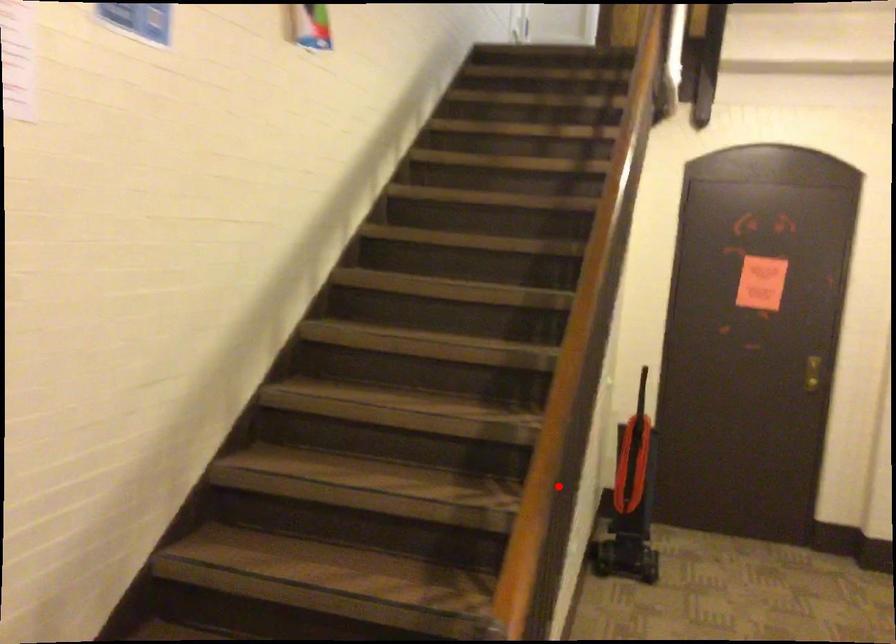
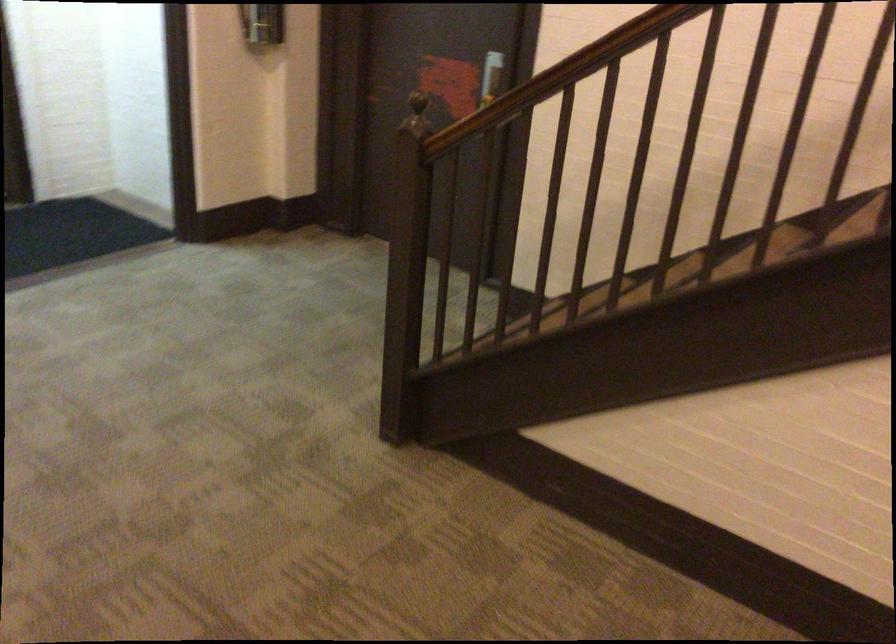
Question: I am providing you with two images of the same scene from different viewpoints. A red point is shown in image1. For the corresponding object point in image2, is it positioned nearer or farther from the camera?

Choices:
 (A) Nearer
 (B) Farther

Answer: (B)